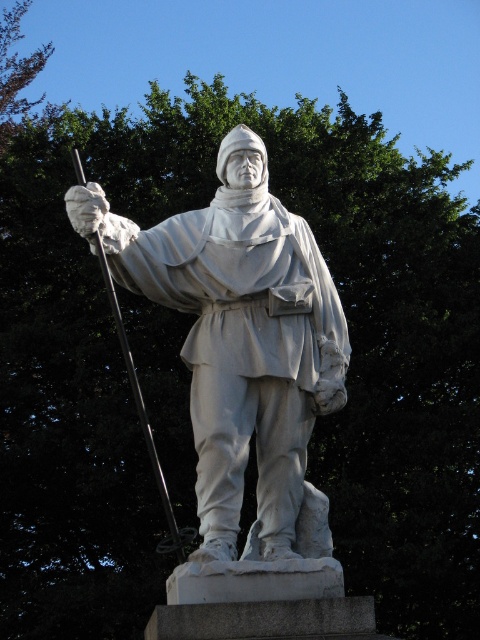
You are an artist planning to paint the statue and the pole. Given that the statue is shorter than the pole, how does the height of the white marble statue at center compare to the white marble pole at center?

The white marble statue at center is shorter than the white marble pole at center.

You are a tourist standing at the entrance of a park. You see the white marble statue at center in the distance. If you want to take a photo of the statue with your phone, which is 15 meters away from you, will you be able to capture the entire statue in the frame?

The white marble statue at center is 32.95 meters away from you. Since your phone is 15 meters away from you, the total distance between the statue and your phone is 47.95 meters. Most phone cameras have a limited zoom range and may not be able to capture the entire statue at such a distance. You might need to move closer or use a zoom lens.

You are standing in front of the statue and want to touch both the white marble statue at center and the white marble pole at center. Which one can you reach first without moving your position?

The white marble statue at center is closer to you, so you can reach it first without moving your position.